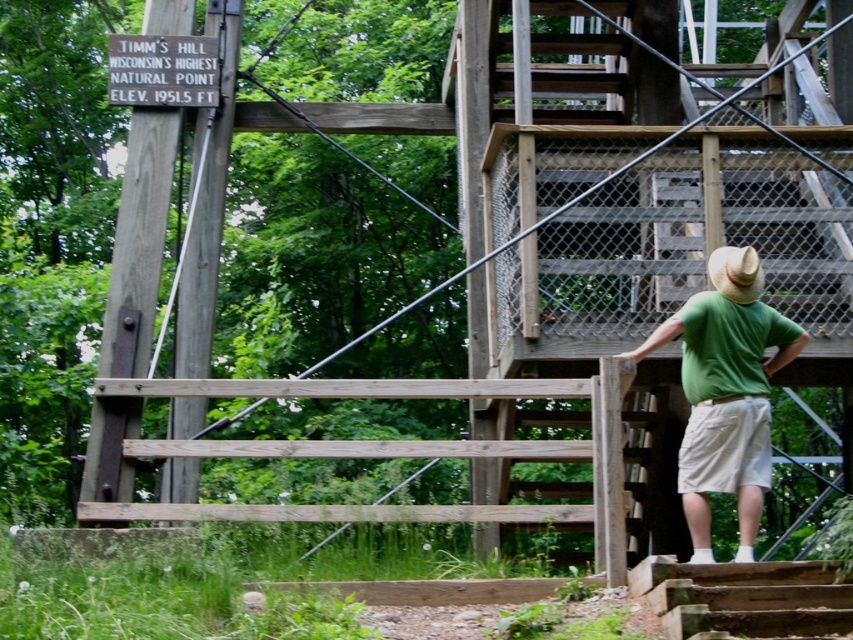
You are a hiker who wants to take a photo of the green matte shirt at right and the wooden stairs at lower right. Which object should be placed closer to the camera to ensure both are in focus?

The green matte shirt at right has a lesser height compared to wooden stairs at lower right, so to ensure both are in focus, the wooden stairs at lower right should be placed closer to the camera since they are taller and need to be within the focal range.

You are a hiker wearing a green matte shirt at right and need to climb the wooden stairs at lower right to reach the observation platform. Can your shirt fit through the spaces between the wooden stairs without getting caught?

The green matte shirt at right is thinner than the wooden stairs at lower right, so it can fit through the spaces between the wooden stairs at lower right without getting caught.